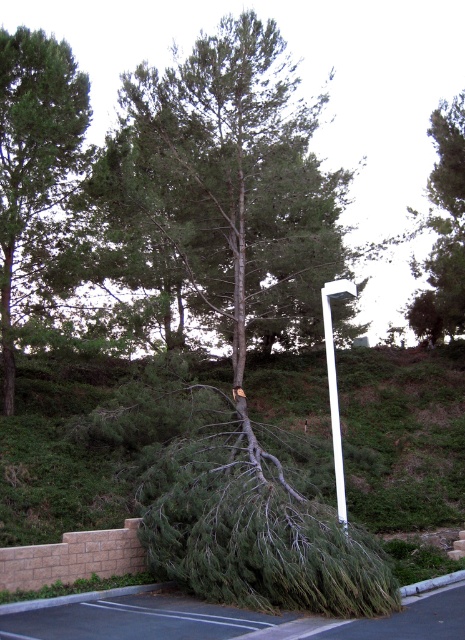
Question: Among these objects, which one is farthest from the camera?

Choices:
 (A) brushed metal curb at lower right
 (B) green leafy tree at upper left

Answer: (B)

Question: Observing the image, what is the correct spatial positioning of green rough bark tree at center in reference to green leafy tree at upper left?

Choices:
 (A) below
 (B) above

Answer: (B)

Question: Does green rough bark tree at upper right appear under brushed metal curb at lower right?

Choices:
 (A) yes
 (B) no

Answer: (B)

Question: Can you confirm if green rough bark tree at center is wider than white glossy street sign at center?

Choices:
 (A) yes
 (B) no

Answer: (A)

Question: Which object is closer to the camera taking this photo?

Choices:
 (A) green rough bark tree at upper right
 (B) green leafy tree at upper left
 (C) brushed metal curb at lower right

Answer: (C)

Question: Which object is farther from the camera taking this photo?

Choices:
 (A) green leafy tree at upper left
 (B) green rough bark tree at upper right
 (C) brushed metal curb at lower right

Answer: (B)